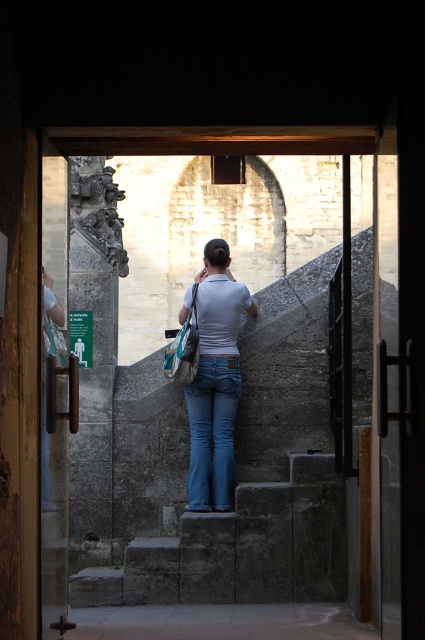
Is denim jeans at center wider than blue denim jeans at center?

Yes.

Does denim jeans at center appear on the right side of blue denim jeans at center?

In fact, denim jeans at center is to the left of blue denim jeans at center.

Between point (203, 420) and point (212, 356), which one is positioned in front?

Point (203, 420)

Identify the location of denim jeans at center. pos(215,381).

Measure the distance from denim jeans at center to teal fabric bag at center.

They are 2.40 meters apart.

Is denim jeans at center thinner than teal fabric bag at center?

In fact, denim jeans at center might be wider than teal fabric bag at center.

Identify the location of denim jeans at center. The width and height of the screenshot is (425, 640). (215, 381).

Can you confirm if gray stone stairs at center is wider than blue denim jeans at center?

Yes, gray stone stairs at center is wider than blue denim jeans at center.

Identify the location of gray stone stairs at center. The width and height of the screenshot is (425, 640). (237, 474).